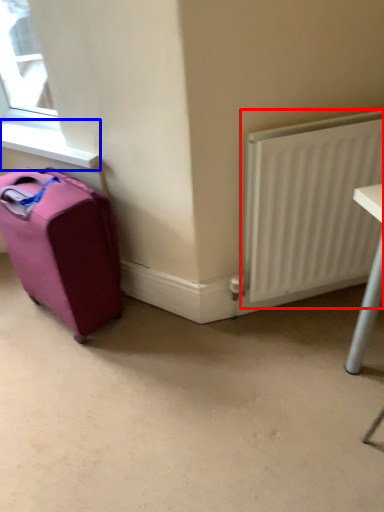
Question: Which point is further to the camera, radiator (highlighted by a red box) or window sill (highlighted by a blue box)?

Choices:
 (A) radiator
 (B) window sill

Answer: (B)